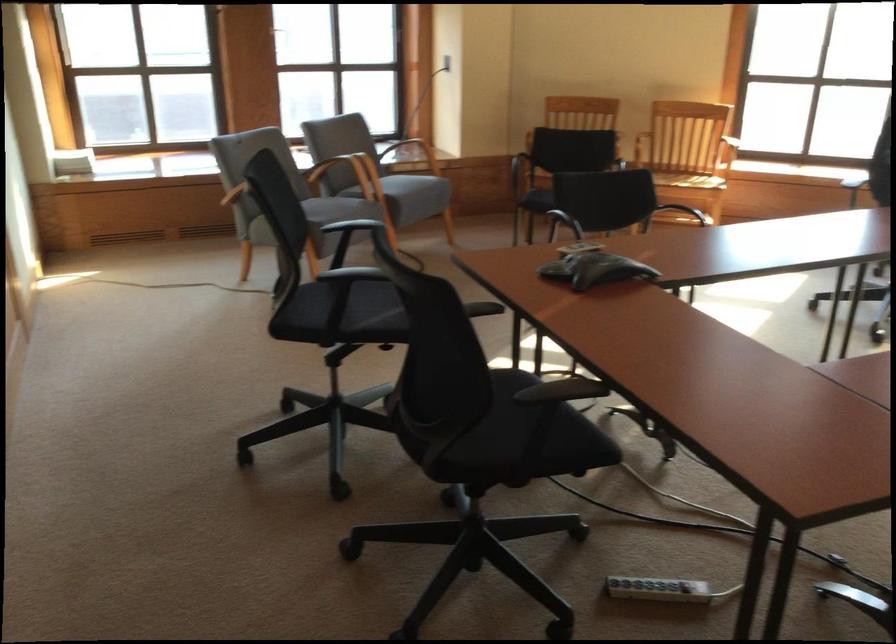
Locate an element on the screen. This screenshot has height=644, width=896. wooden chair sitting surface is located at coordinates (687, 176).